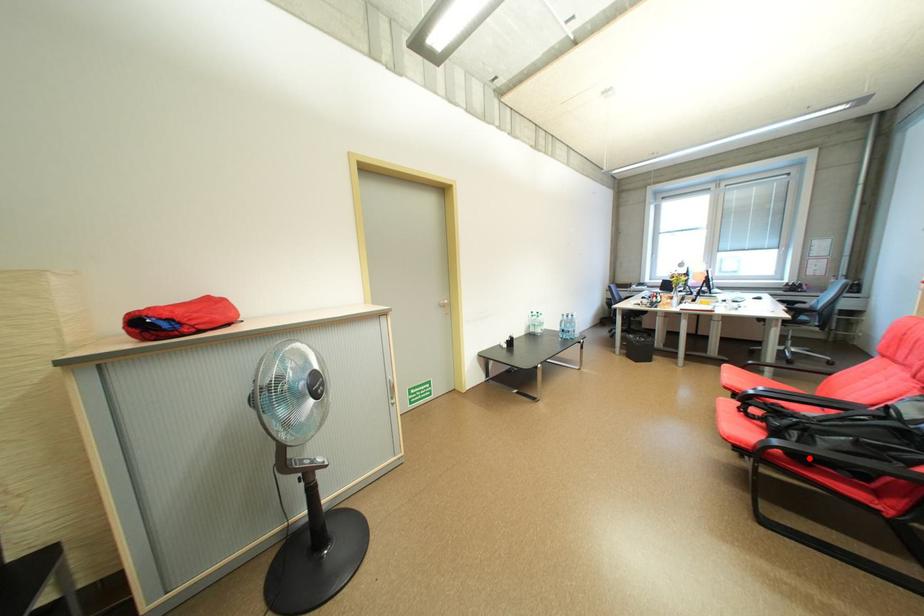
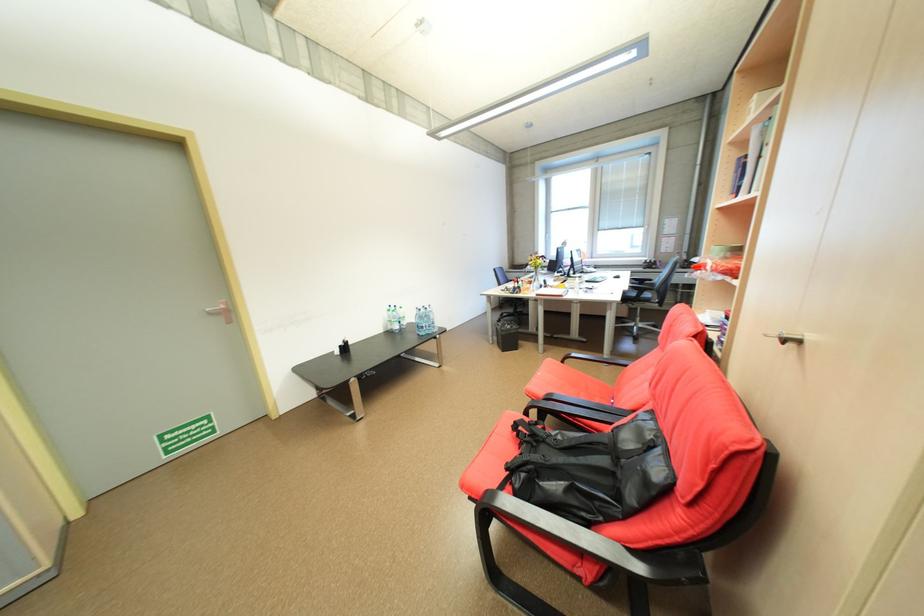
The point at the highlighted location is marked in the first image. Where is the corresponding point in the second image?

(529, 511)